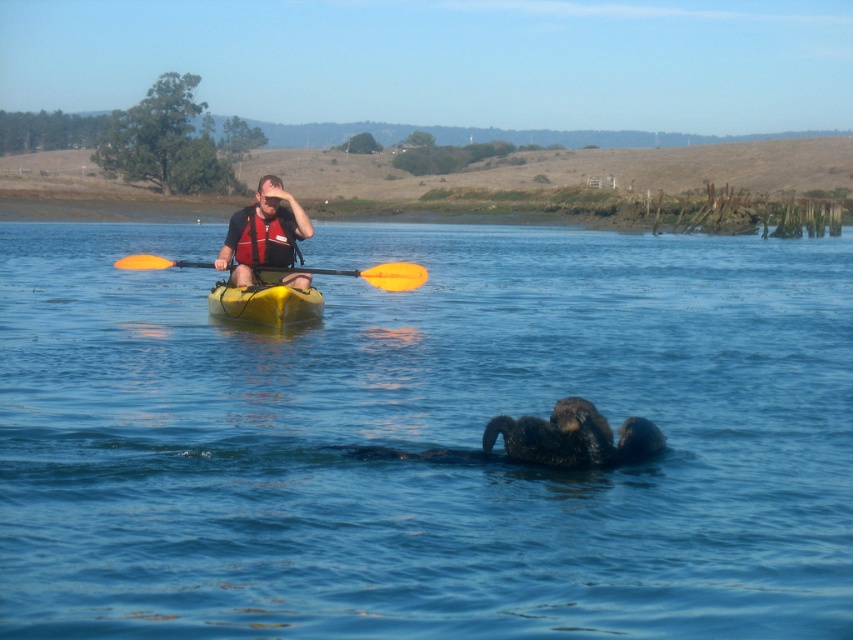
You are a photographer trying to capture a clear shot of both the matte red life vest at center and the yellow matte canoe at center. Since the person is in the water, which object should you focus on first to ensure both are in focus?

The matte red life vest at center is in front of the yellow matte canoe at center, so you should focus on the matte red life vest at center first to ensure both are in focus.

You are a photographer trying to capture a closeup shot of the sea otter in the foreground. You have two points marked on your camera screen to focus on. One is at point (270, 195) and the other is at point (241, 212). Which point should you choose to ensure the otter is in focus?

Point (270, 195) is closer to the camera than point (241, 212), so you should choose point (270, 195) to ensure the sea otter in the foreground is in focus.

In the scene shown: You are a photographer trying to capture a closeup of the matte red life vest at center and the orange plastic paddle at center. Which object should you focus on first to ensure both are in focus?

The matte red life vest at center is closer to the viewer than the orange plastic paddle at center. To ensure both are in focus, focus on the matte red life vest at center first, as it is the closer object.